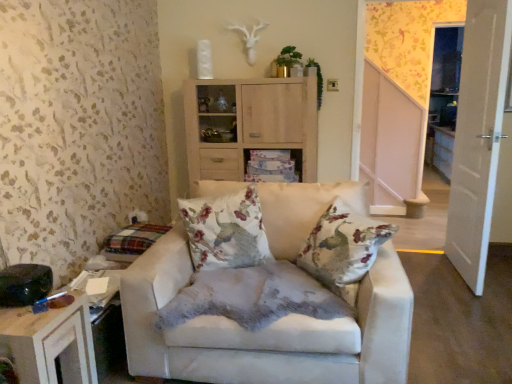
Question: Considering the positions of floral fabric cushion at center and white glossy door at right in the image, is floral fabric cushion at center wider or thinner than white glossy door at right?

Choices:
 (A) thin
 (B) wide

Answer: (B)

Question: Is floral fabric cushion at center inside the boundaries of white glossy door at right, or outside?

Choices:
 (A) inside
 (B) outside

Answer: (B)

Question: Based on their relative distances, which object is farther from the white glossy door at right?

Choices:
 (A) white glossy cabinet at center
 (B) suede beige armchair at center
 (C) floral fabric cushion at center
 (D) light wood cabinet at upper center
 (E) wooden table at lower left

Answer: (E)

Question: Estimate the real-world distances between objects in this image. Which object is closer to the light wood cabinet at upper center?

Choices:
 (A) suede beige armchair at center
 (B) floral fabric cushion at center
 (C) white glossy door at right
 (D) wooden table at lower left
 (E) white glossy cabinet at center

Answer: (E)